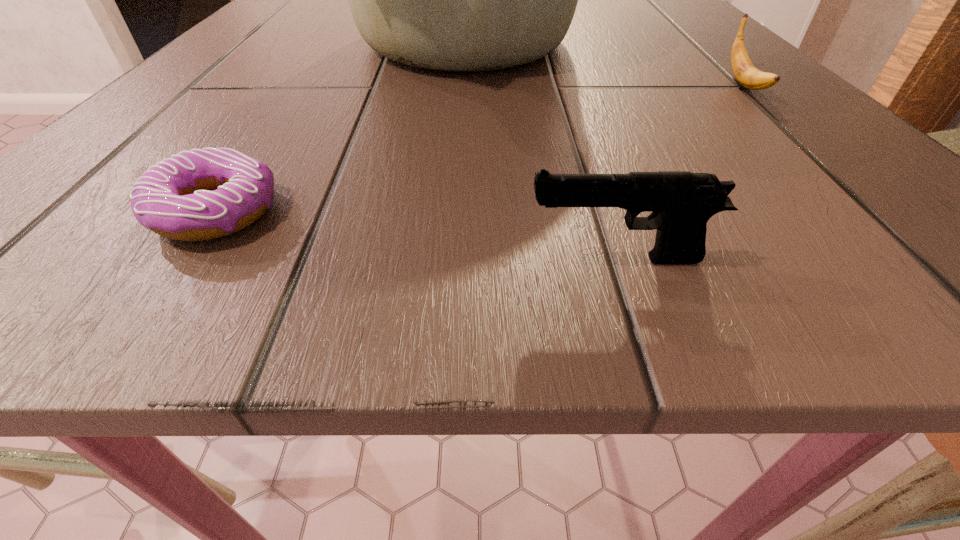
In the image, there is a desktop. What are the coordinates of `vacant region at the near left corner` in the screenshot? It's located at (161, 291).

This screenshot has height=540, width=960. Find the location of `blank space at the far right corner of the desktop`. blank space at the far right corner of the desktop is located at coordinates (658, 17).

In the image, there is a desktop. Identify the location of vacant area at the near right corner. The height and width of the screenshot is (540, 960). (781, 247).

The height and width of the screenshot is (540, 960). What are the coordinates of `free area in between the banana and the tallest object` in the screenshot? It's located at (605, 64).

Identify the location of vacant space that is in between the pistol and the tallest object. (542, 151).

Locate an element on the screen. This screenshot has width=960, height=540. empty space between the shortest object and the pistol is located at coordinates (417, 235).

Where is `free space between the banana and the tallest object`? This screenshot has height=540, width=960. free space between the banana and the tallest object is located at coordinates (605, 64).

Locate an element on the screen. Image resolution: width=960 pixels, height=540 pixels. free spot between the saucepan and the pistol is located at coordinates (542, 151).

In order to click on free spot between the rightmost object and the tallest object in this screenshot , I will do `click(605, 64)`.

This screenshot has height=540, width=960. I want to click on vacant space that is in between the saucepan and the shortest object, so click(341, 127).